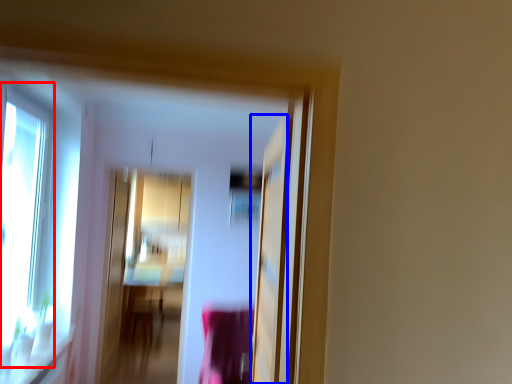
Question: Which of the following is the closest to the observer, window (highlighted by a red box) or screen door (highlighted by a blue box)?

Choices:
 (A) window
 (B) screen door

Answer: (B)